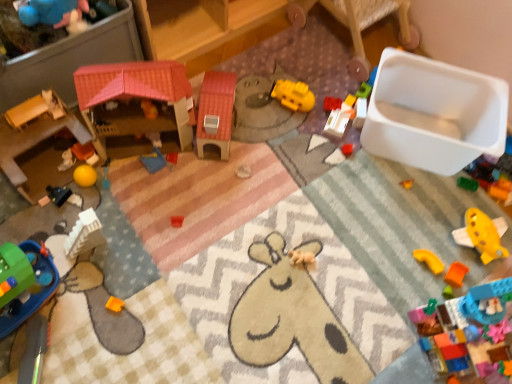
Locate an element on the screen. free space to the left of yellow matte plastic arch at lower right, acting as the 4th toy starting from the right is located at coordinates (375, 258).